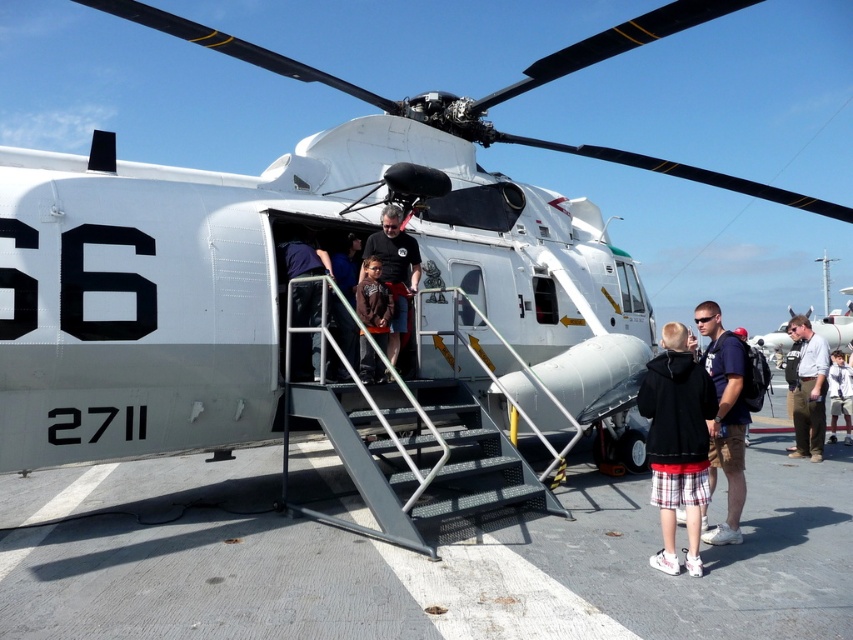
Question: Does metallic gray stairs at center lie behind brown cotton hoodie at center?

Choices:
 (A) no
 (B) yes

Answer: (A)

Question: Can you confirm if metallic gray stairs at center is wider than black hoodie at lower right?

Choices:
 (A) yes
 (B) no

Answer: (A)

Question: Which of the following is the closest to the observer?

Choices:
 (A) (834, 369)
 (B) (428, 481)
 (C) (740, 448)
 (D) (666, 376)

Answer: (D)

Question: Which of the following is the closest to the observer?

Choices:
 (A) matte black t-shirt at center
 (B) dark blue uniform at center
 (C) white cotton shirt at center

Answer: (A)

Question: Which object appears farthest from the camera in this image?

Choices:
 (A) black hoodie at lower right
 (B) brown cotton hoodie at center
 (C) dark blue uniform at center

Answer: (C)

Question: Is metallic gray stairs at center smaller than white shirt at right?

Choices:
 (A) yes
 (B) no

Answer: (B)